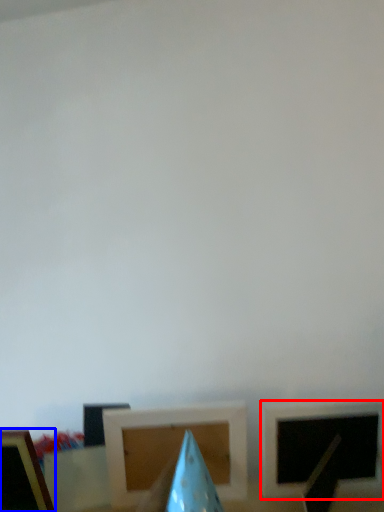
Question: Which of the following is the closest to the observer, picture frame (highlighted by a red box) or picture frame (highlighted by a blue box)?

Choices:
 (A) picture frame
 (B) picture frame

Answer: (B)